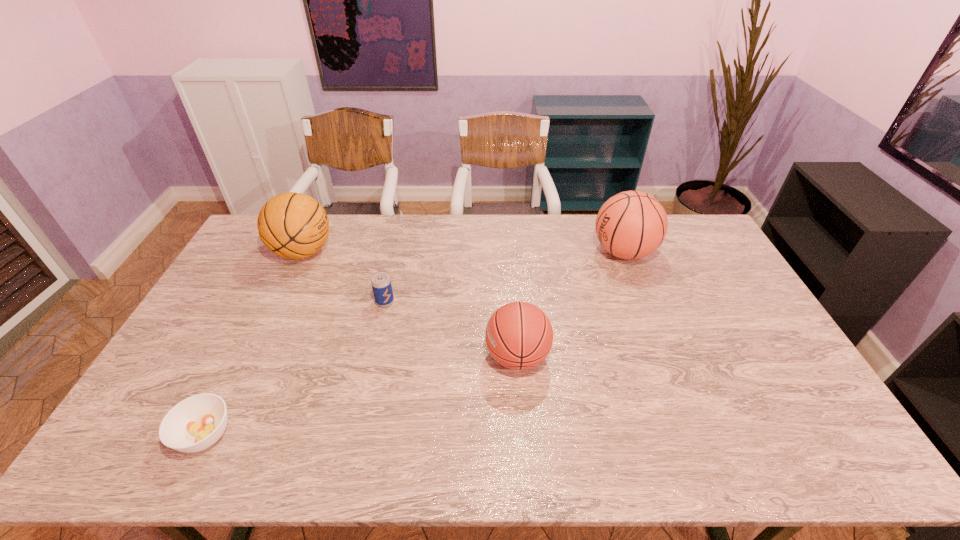
Identify the location of vacant point located between the rightmost basketball and the second shortest object. This screenshot has height=540, width=960. (504, 277).

This screenshot has width=960, height=540. I want to click on vacant area between the leftmost basketball and the rightmost object, so click(x=464, y=252).

Where is `empty space that is in between the beer can and the leftmost basketball`? empty space that is in between the beer can and the leftmost basketball is located at coordinates (344, 277).

Find the location of a particular element. The width and height of the screenshot is (960, 540). empty location between the leftmost basketball and the shortest object is located at coordinates (254, 343).

Find the location of a particular element. The width and height of the screenshot is (960, 540). free point between the leftmost basketball and the rightmost basketball is located at coordinates (464, 252).

Locate an element on the screen. vacant region between the second nearest object and the leftmost basketball is located at coordinates (410, 304).

The image size is (960, 540). I want to click on free space that is in between the leftmost basketball and the third farthest object, so (x=344, y=277).

I want to click on object that ranks as the second closest to the second nearest object, so click(631, 225).

Identify the location of the fourth closest object to the shortest object. (631, 225).

Locate an element on the screen. The image size is (960, 540). the closest basketball to the third shortest object is located at coordinates (631, 225).